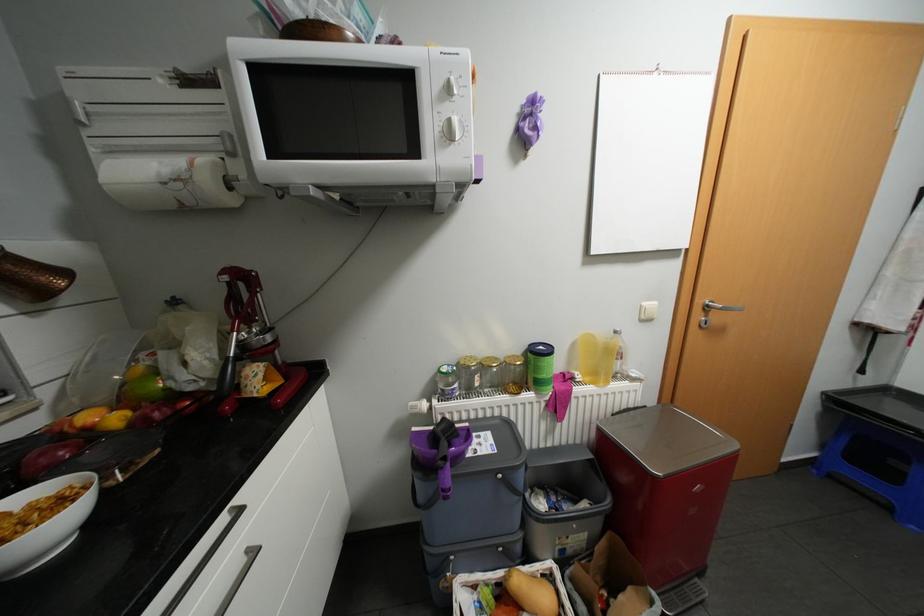
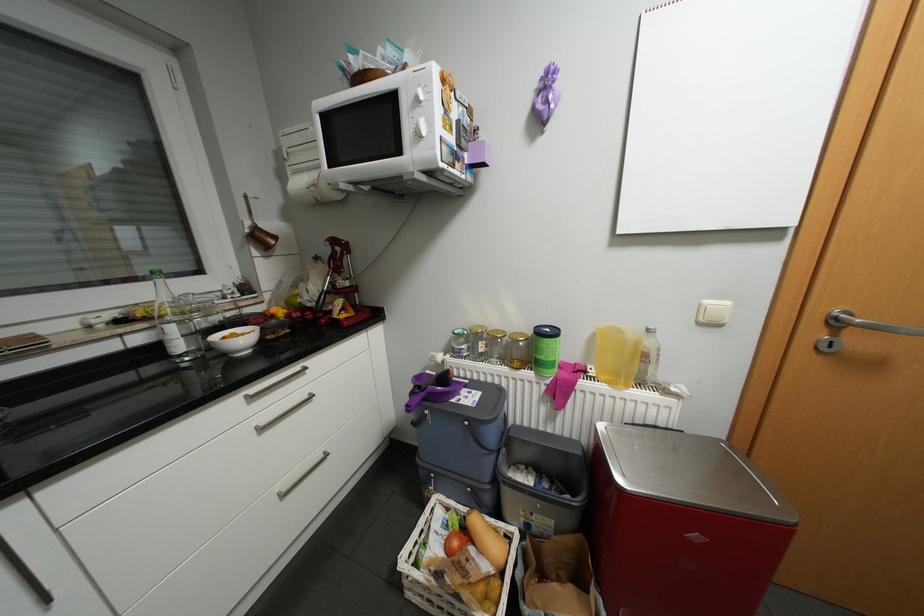
In the second image, find the point that corresponds to point 198,387 in the first image.

(317, 304)